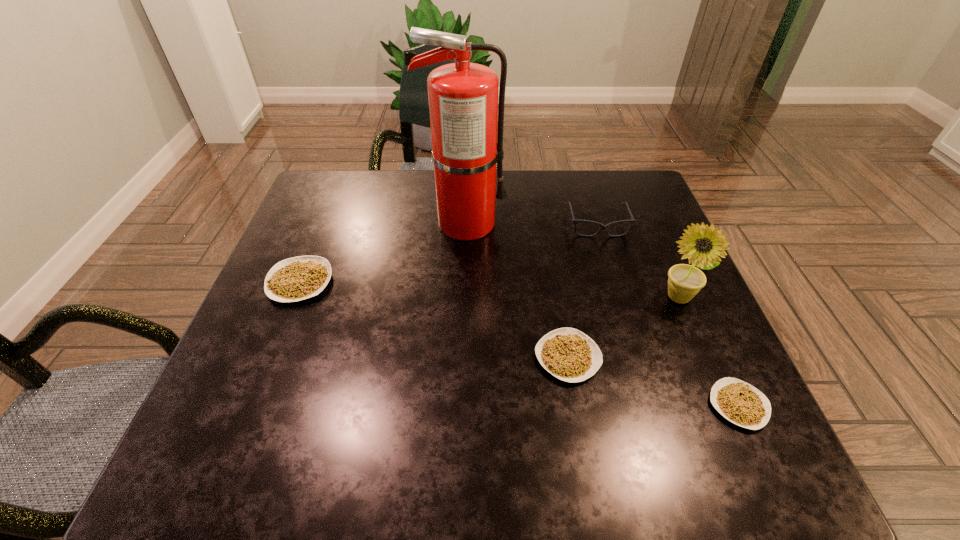
This screenshot has height=540, width=960. Identify the location of the leftmost legume. (298, 278).

Identify the location of the farthest legume. [298, 278].

Find the location of a particular element. This screenshot has height=540, width=960. the second tallest legume is located at coordinates [x=568, y=354].

You are a GUI agent. You are given a task and a screenshot of the screen. Output one action in this format:
    pyautogui.click(x=<x>, y=<y>)
    Task: Click on the second legume from right to left
    
    Given the screenshot: What is the action you would take?
    pyautogui.click(x=568, y=354)

At what (x,y) coordinates should I click in order to perform the action: click on the shortest object. Please return your answer as a coordinate pair (x, y). Looking at the image, I should click on (739, 402).

This screenshot has height=540, width=960. I want to click on the shortest legume, so click(739, 402).

Where is `fire extinguisher`? The height and width of the screenshot is (540, 960). fire extinguisher is located at coordinates (463, 97).

Find the location of a particular element. Image resolution: width=960 pixels, height=540 pixels. the tallest object is located at coordinates (463, 97).

The width and height of the screenshot is (960, 540). I want to click on spectacles, so click(602, 227).

Locate an element on the screen. Image resolution: width=960 pixels, height=540 pixels. the second tallest object is located at coordinates (685, 281).